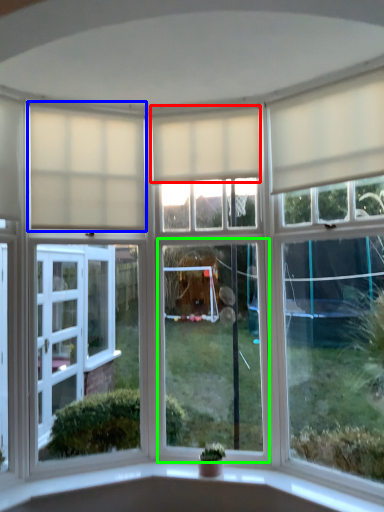
Question: Which object is the farthest from curtain (highlighted by a red box)? Choose among these: curtain (highlighted by a blue box) or window (highlighted by a green box).

Choices:
 (A) curtain
 (B) window

Answer: (B)